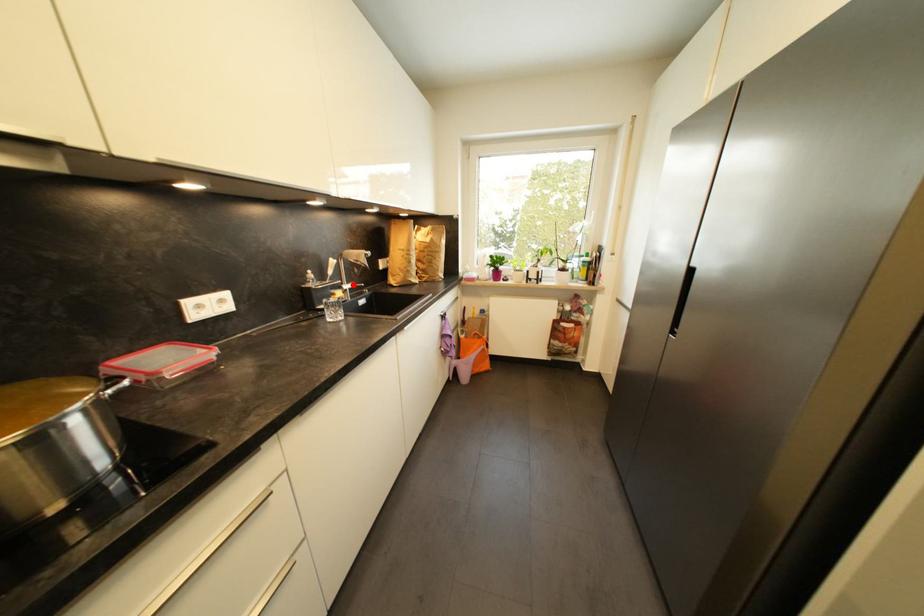
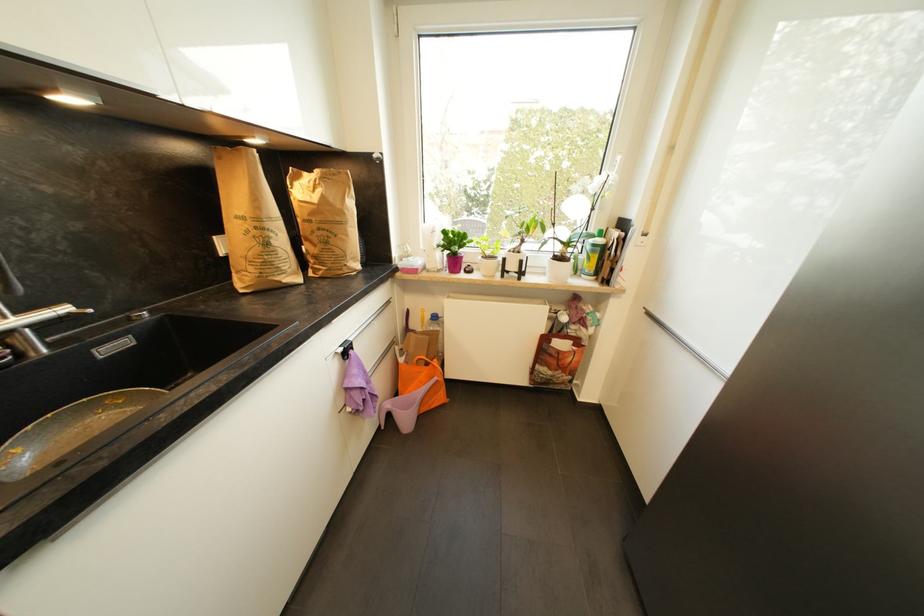
Question: I am providing you with two images of the same scene from different viewpoints. In image1, a red point is highlighted. Considering the same 3D point in image2, which of the following is correct?

Choices:
 (A) It is closer
 (B) It is farther

Answer: (B)